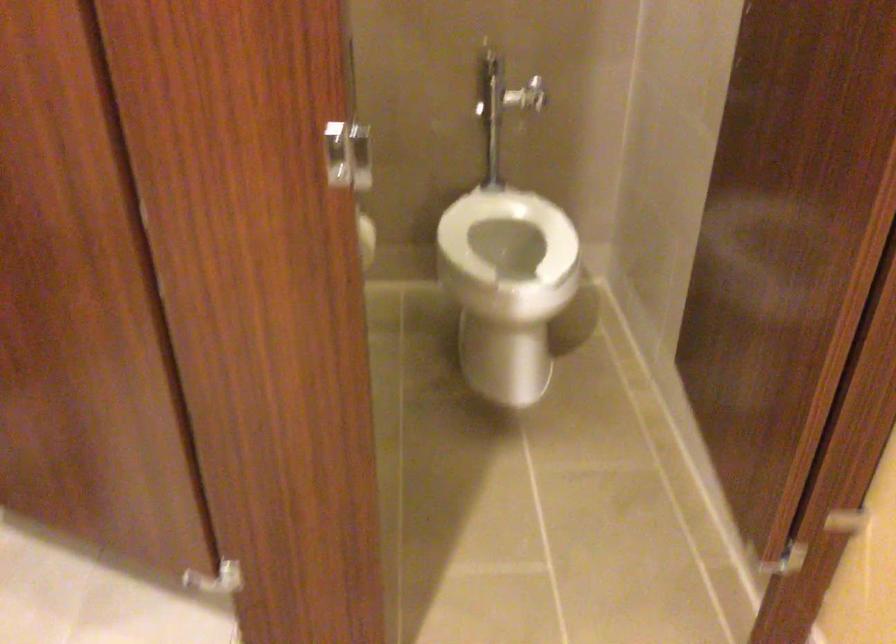
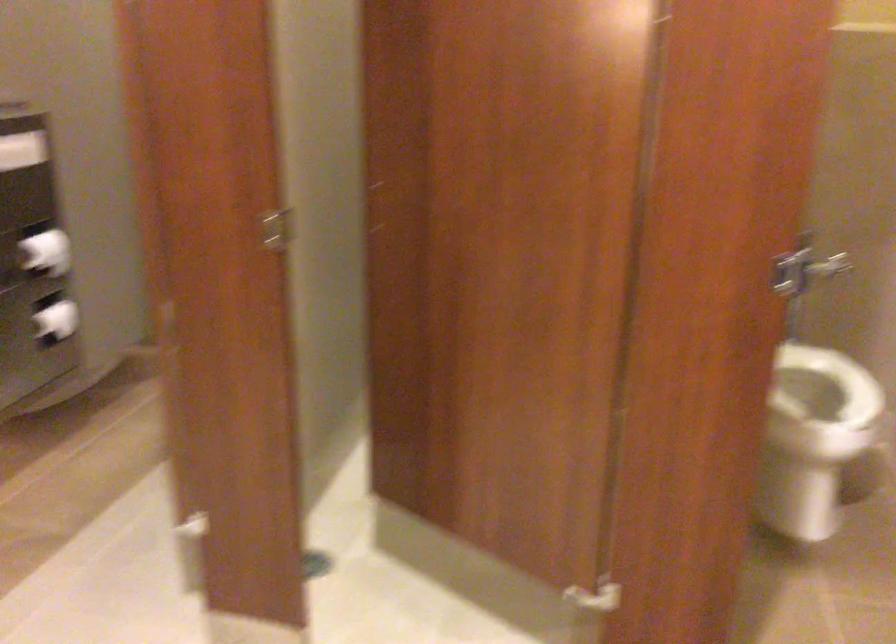
Question: The camera is either moving clockwise (left) or counter-clockwise (right) around the object. The first image is from the beginning of the video and the second image is from the end. Is the camera moving left or right when shooting the video?

Choices:
 (A) Left
 (B) Right

Answer: (B)